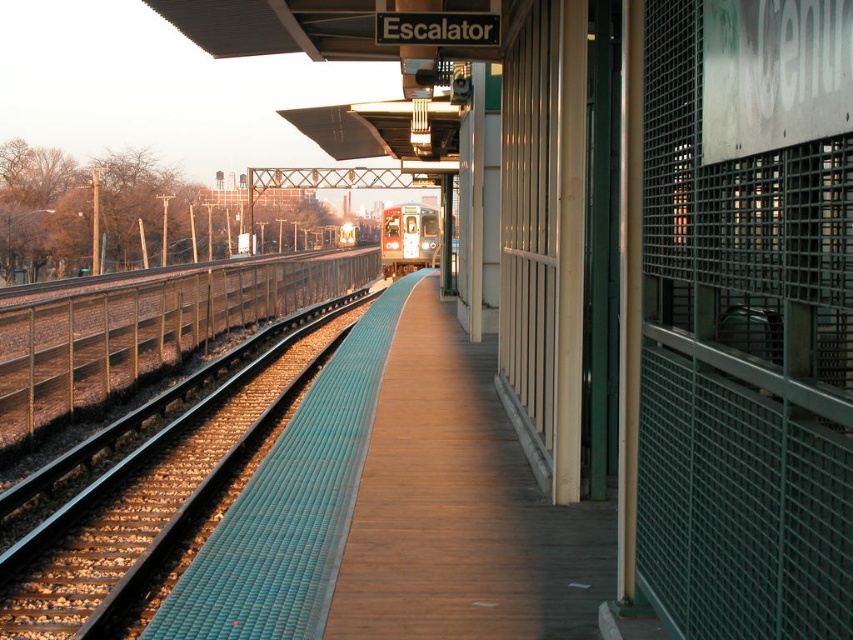
Question: Which object appears closest to the camera in this image?

Choices:
 (A) teal rubber track at center
 (B) brown wooden rail at left
 (C) silver metallic train at center

Answer: (A)

Question: Based on their relative distances, which object is farther from the teal rubber track at center?

Choices:
 (A) brown wooden rail at left
 (B) silver metallic train at center

Answer: (B)

Question: Which point is closer to the camera taking this photo?

Choices:
 (A) (54, 289)
 (B) (282, 404)

Answer: (B)

Question: Is teal rubber track at center behind silver metallic train at center?

Choices:
 (A) yes
 (B) no

Answer: (B)

Question: Can you confirm if teal rubber track at center is positioned to the right of silver metallic train at center?

Choices:
 (A) no
 (B) yes

Answer: (A)

Question: Does teal rubber track at center appear under silver metallic train at center?

Choices:
 (A) no
 (B) yes

Answer: (B)